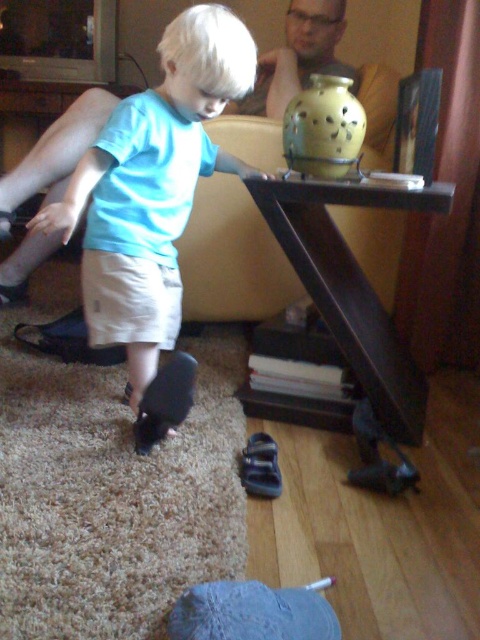
Who is positioned more to the left, matte black shoe at lower left or matte black laptop at upper left?

From the viewer's perspective, matte black shoe at lower left appears more on the left side.

Who is more distant from viewer, (x=223, y=45) or (x=288, y=45)?

Positioned behind is point (x=288, y=45).

Locate an element on the screen. Image resolution: width=480 pixels, height=640 pixels. matte black shoe at lower left is located at coordinates (154, 205).

Can you confirm if matte black shoe at lower left is taller than yellow matte vase at upper center?

Indeed, matte black shoe at lower left has a greater height compared to yellow matte vase at upper center.

Describe the element at coordinates (154, 205) in the screenshot. I see `matte black shoe at lower left` at that location.

The image size is (480, 640). In order to click on matte black shoe at lower left in this screenshot , I will do `click(154, 205)`.

Does matte black laptop at upper left lie behind yellow matte vase at upper center?

Yes, matte black laptop at upper left is behind yellow matte vase at upper center.

Can you confirm if matte black laptop at upper left is taller than yellow matte vase at upper center?

Correct, matte black laptop at upper left is much taller as yellow matte vase at upper center.

Identify the location of matte black laptop at upper left. The width and height of the screenshot is (480, 640). (317, 68).